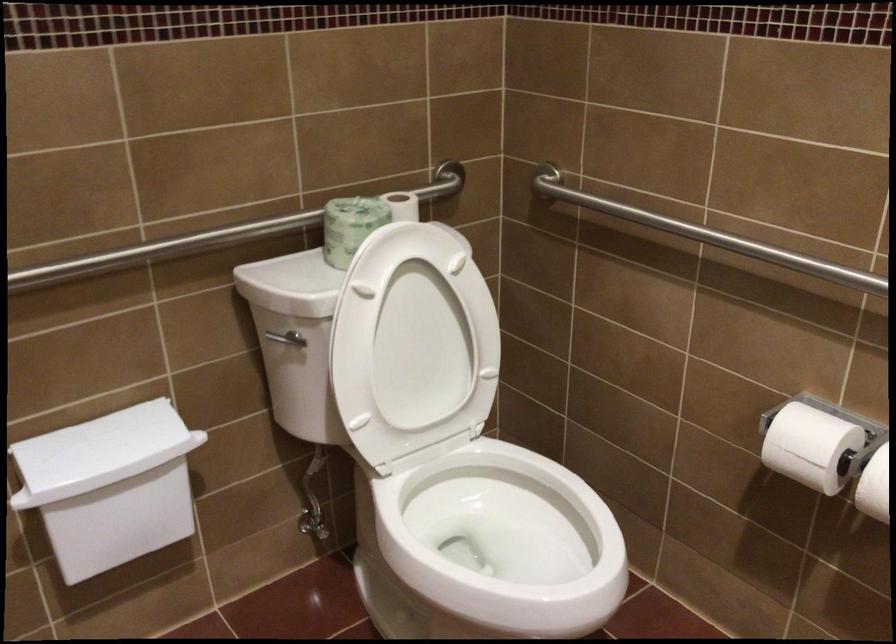
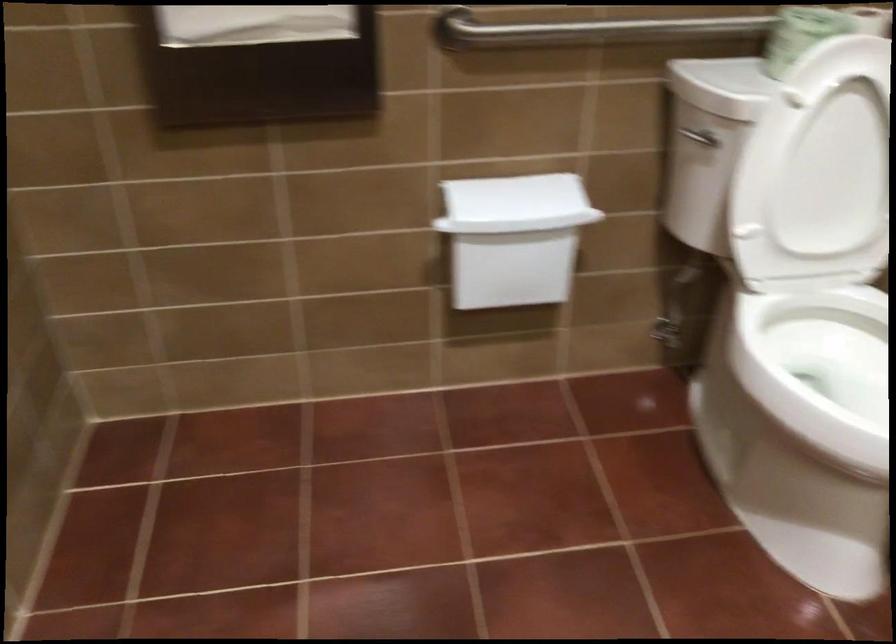
Locate, in the second image, the point that corresponds to (105,450) in the first image.

(513, 196)